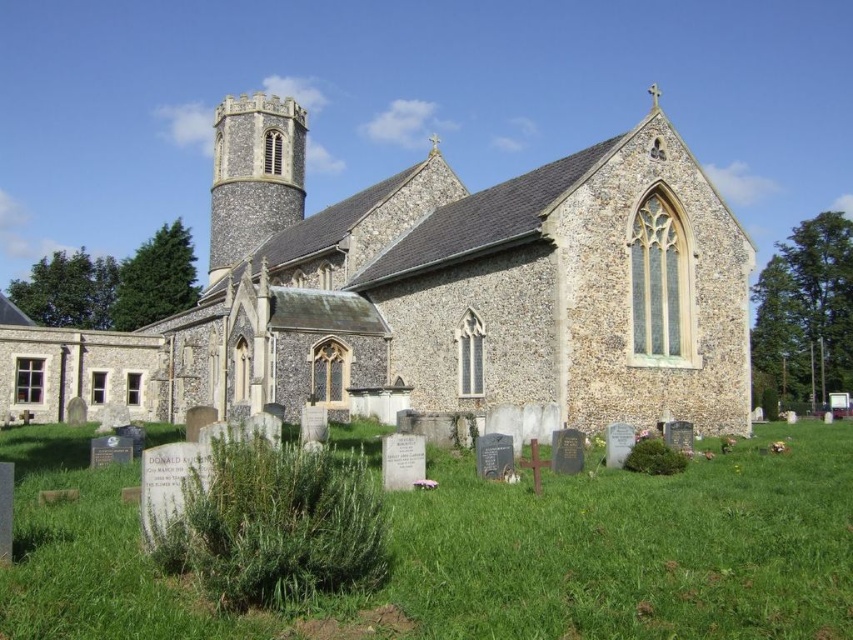
You are standing in the cemetery and see the point marked at coordinates (433, 292). Based on the scene description, what object is located at this point?

The point at coordinates (433, 292) corresponds to the brown stone church at center.

You are standing in the cemetery looking at the brown stone church at center and the green grass at lower center. Which object is positioned higher in the image?

The brown stone church at center is located above the green grass at lower center, so it is positioned higher in the image.

You are standing in the cemetery and want to take a photo of the brown stone church at center. However, there is green grass at lower center in front of it. Will the grass block the view of the church in your photo?

The brown stone church at center is much taller than the green grass at lower center, so the grass will not block the view of the church in your photo.